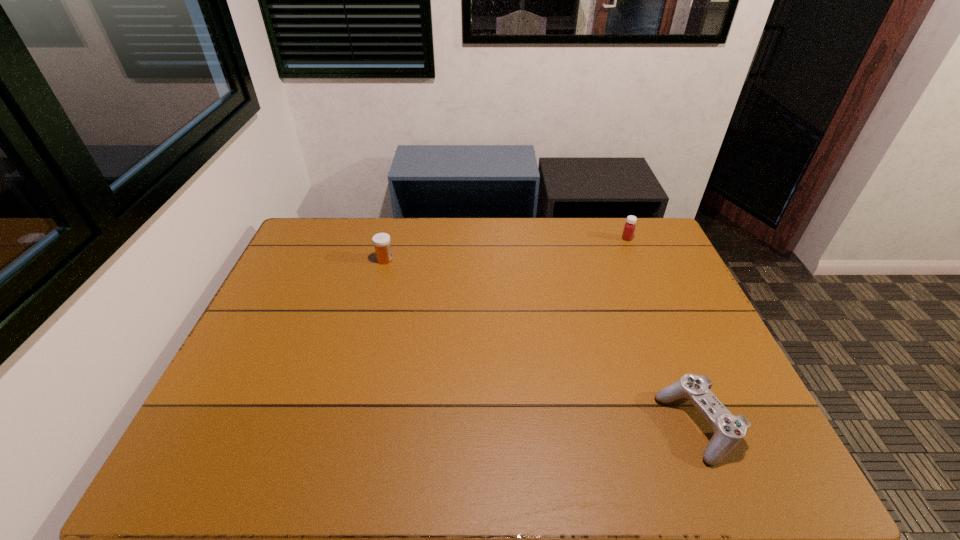
This screenshot has width=960, height=540. I want to click on free point between the nearest object and the farther medicine, so click(x=662, y=332).

This screenshot has height=540, width=960. I want to click on empty space that is in between the nearer medicine and the shortest object, so click(541, 343).

Where is `free spot between the nearer medicine and the nearest object`? free spot between the nearer medicine and the nearest object is located at coordinates (541, 343).

Locate an element on the screen. vacant region between the nearest object and the right medicine is located at coordinates (662, 332).

At what (x,y) coordinates should I click in order to perform the action: click on free space between the control and the nearer medicine. Please return your answer as a coordinate pair (x, y). The height and width of the screenshot is (540, 960). Looking at the image, I should click on (541, 343).

Where is `free space between the right medicine and the second farthest object`? free space between the right medicine and the second farthest object is located at coordinates (506, 249).

The width and height of the screenshot is (960, 540). Find the location of `vacant area between the shortest object and the farther medicine`. vacant area between the shortest object and the farther medicine is located at coordinates (662, 332).

Find the location of a particular element. The height and width of the screenshot is (540, 960). free space between the leftmost object and the right medicine is located at coordinates (506, 249).

I want to click on the closest object to the shortest object, so (x=629, y=227).

Locate which object ranks second in proximity to the farther medicine. Please provide its 2D coordinates. Your answer should be formatted as a tuple, i.e. [(x, y)], where the tuple contains the x and y coordinates of a point satisfying the conditions above.

[(381, 241)]